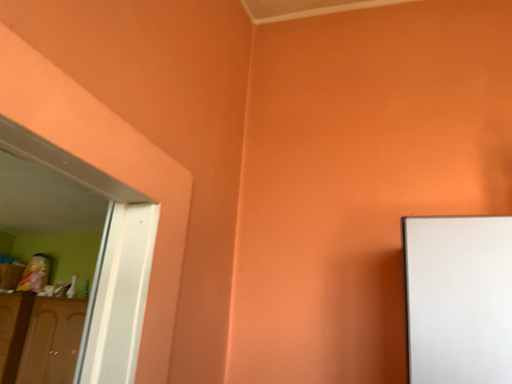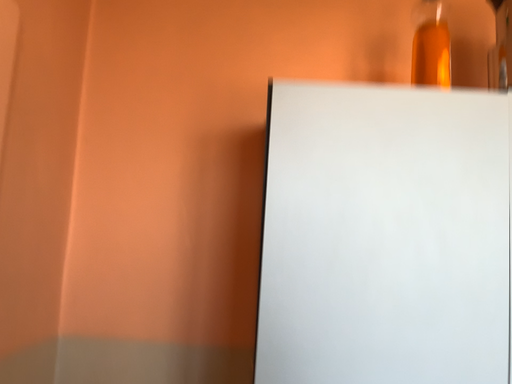
Question: How did the camera likely rotate when shooting the video?

Choices:
 (A) rotated right
 (B) rotated left

Answer: (A)